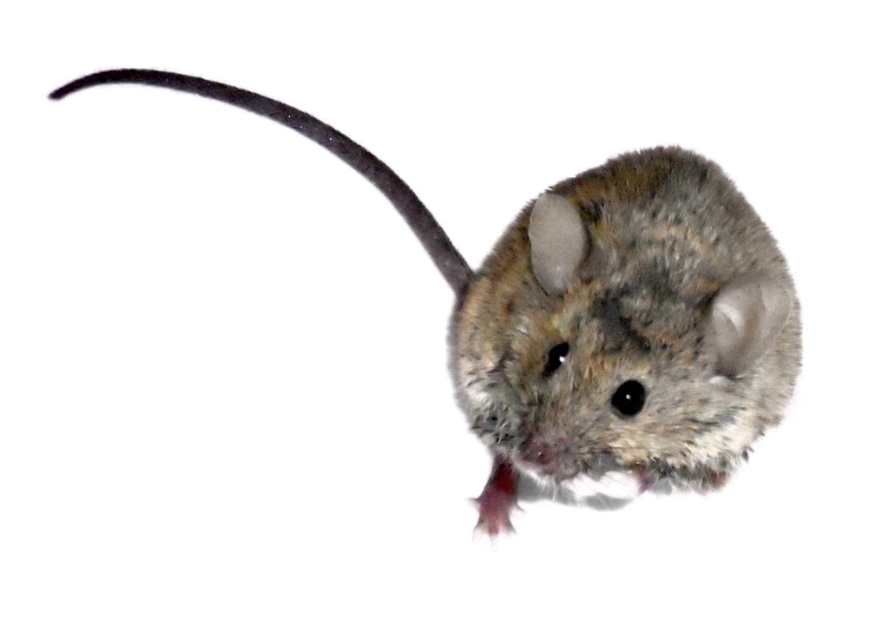
Question: Can you confirm if fuzzy gray mouse at center is positioned to the right of silvery metallic tail at upper left?

Choices:
 (A) yes
 (B) no

Answer: (A)

Question: Among these points, which one is nearest to the camera?

Choices:
 (A) (355, 150)
 (B) (586, 419)

Answer: (B)

Question: Considering the relative positions of fuzzy gray mouse at center and silvery metallic tail at upper left in the image provided, where is fuzzy gray mouse at center located with respect to silvery metallic tail at upper left?

Choices:
 (A) right
 (B) left

Answer: (A)

Question: Is the position of fuzzy gray mouse at center more distant than that of silvery metallic tail at upper left?

Choices:
 (A) yes
 (B) no

Answer: (B)

Question: Which object appears farthest from the camera in this image?

Choices:
 (A) silvery metallic tail at upper left
 (B) fuzzy gray mouse at center

Answer: (A)